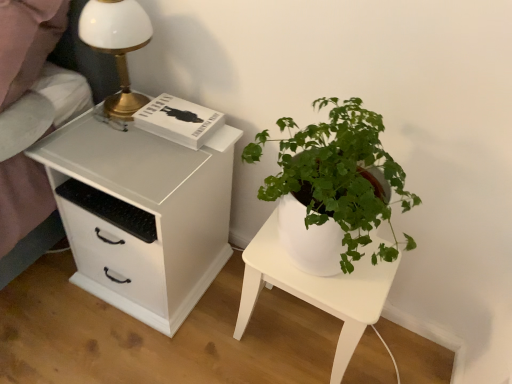
Question: Does white matte chest of drawers at left appear on the right side of white glossy table lamp at upper left?

Choices:
 (A) yes
 (B) no

Answer: (A)

Question: Is white matte chest of drawers at left smaller than white glossy table lamp at upper left?

Choices:
 (A) yes
 (B) no

Answer: (B)

Question: Is white matte chest of drawers at left not near white glossy table lamp at upper left?

Choices:
 (A) no
 (B) yes

Answer: (A)

Question: Considering the relative sizes of white matte chest of drawers at left and white glossy table lamp at upper left in the image provided, is white matte chest of drawers at left bigger than white glossy table lamp at upper left?

Choices:
 (A) no
 (B) yes

Answer: (B)

Question: Does white matte chest of drawers at left lie in front of white glossy table lamp at upper left?

Choices:
 (A) yes
 (B) no

Answer: (A)

Question: Is white glossy table lamp at upper left spatially inside white glossy nightstand at lower right, or outside of it?

Choices:
 (A) outside
 (B) inside

Answer: (A)

Question: In the image, is white glossy table lamp at upper left positioned in front of or behind white glossy nightstand at lower right?

Choices:
 (A) behind
 (B) front

Answer: (B)

Question: Is white glossy table lamp at upper left taller or shorter than white glossy nightstand at lower right?

Choices:
 (A) tall
 (B) short

Answer: (B)

Question: From the image's perspective, relative to white glossy nightstand at lower right, is white glossy table lamp at upper left above or below?

Choices:
 (A) above
 (B) below

Answer: (A)

Question: Is white glossy table lamp at upper left situated inside white matte chest of drawers at left or outside?

Choices:
 (A) outside
 (B) inside

Answer: (A)

Question: Is white glossy table lamp at upper left in front of or behind white matte chest of drawers at left in the image?

Choices:
 (A) front
 (B) behind

Answer: (B)

Question: Based on their sizes in the image, would you say white glossy table lamp at upper left is bigger or smaller than white matte chest of drawers at left?

Choices:
 (A) big
 (B) small

Answer: (B)

Question: Looking at their shapes, would you say white glossy table lamp at upper left is wider or thinner than white matte chest of drawers at left?

Choices:
 (A) wide
 (B) thin

Answer: (B)

Question: Looking at the image, does white glossy nightstand at lower right seem bigger or smaller compared to white glossy table lamp at upper left?

Choices:
 (A) big
 (B) small

Answer: (A)

Question: Based on their positions, is white glossy nightstand at lower right located to the left or right of white glossy table lamp at upper left?

Choices:
 (A) left
 (B) right

Answer: (B)